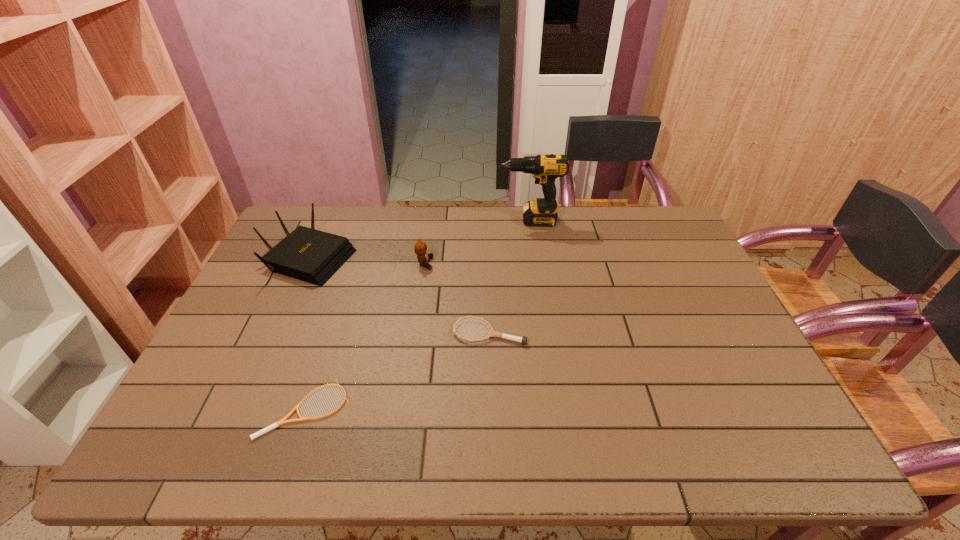
Where is `the farthest object`? The width and height of the screenshot is (960, 540). the farthest object is located at coordinates (545, 168).

Locate an element on the screen. the tallest object is located at coordinates (545, 168).

The width and height of the screenshot is (960, 540). Find the location of `the fourth shortest object`. the fourth shortest object is located at coordinates (313, 256).

Where is `the third object from right to left`? The height and width of the screenshot is (540, 960). the third object from right to left is located at coordinates (420, 248).

This screenshot has width=960, height=540. Identify the location of teddy bear. (420, 248).

Identify the location of the fourth farthest object. This screenshot has height=540, width=960. (492, 333).

Locate an element on the screen. This screenshot has height=540, width=960. the taller tennis racket is located at coordinates (492, 333).

The width and height of the screenshot is (960, 540). Find the location of `the nearest object`. the nearest object is located at coordinates (283, 421).

This screenshot has height=540, width=960. I want to click on the left tennis racket, so click(283, 421).

Identify the location of vacant space located at the tip of the drill. (391, 221).